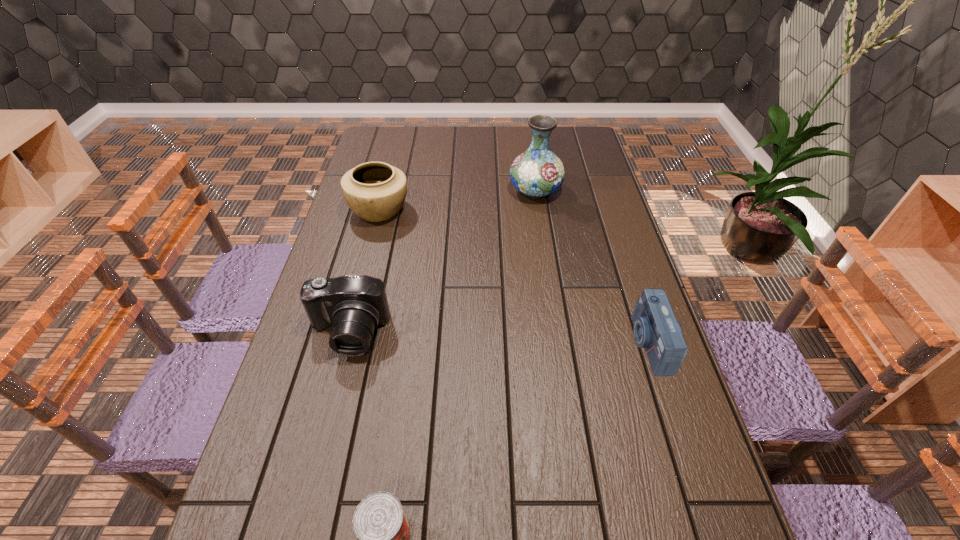
You are a GUI agent. You are given a task and a screenshot of the screen. Output one action in this format:
    pyautogui.click(x=<x>, y=<y>)
    Task: Click on the unoccupied area between the pottery and the shorter camera
    
    Given the screenshot: What is the action you would take?
    pyautogui.click(x=515, y=276)

The image size is (960, 540). What are the coordinates of `free spot between the left camera and the tallest object` in the screenshot? It's located at (442, 262).

Find the location of `free space between the left camera and the vase`. free space between the left camera and the vase is located at coordinates (442, 262).

Select which object appears as the closest to the pottery. Please provide its 2D coordinates. Your answer should be formatted as a tuple, i.e. [(x, y)], where the tuple contains the x and y coordinates of a point satisfying the conditions above.

[(354, 305)]

Choose which object is the third nearest neighbor to the nearest object. Please provide its 2D coordinates. Your answer should be formatted as a tuple, i.e. [(x, y)], where the tuple contains the x and y coordinates of a point satisfying the conditions above.

[(375, 191)]